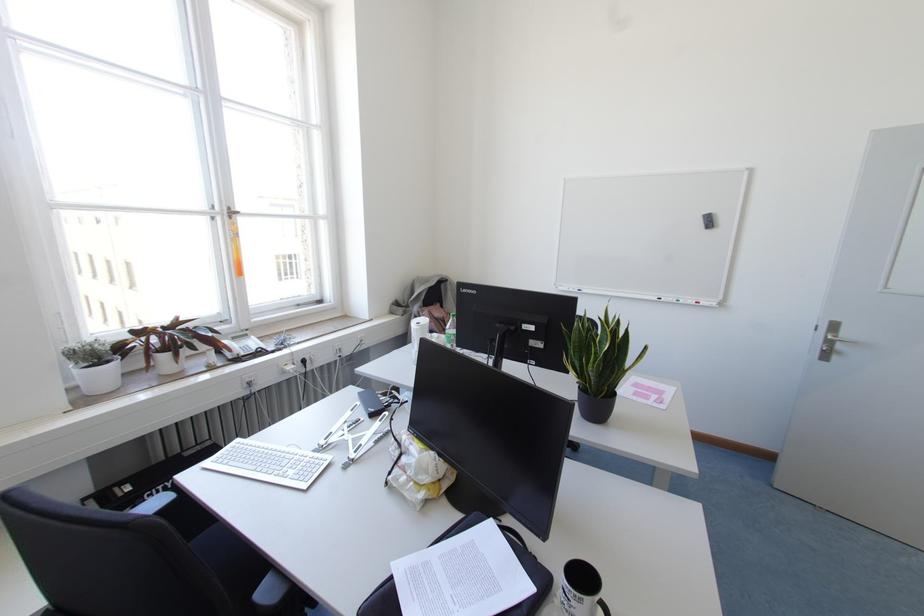
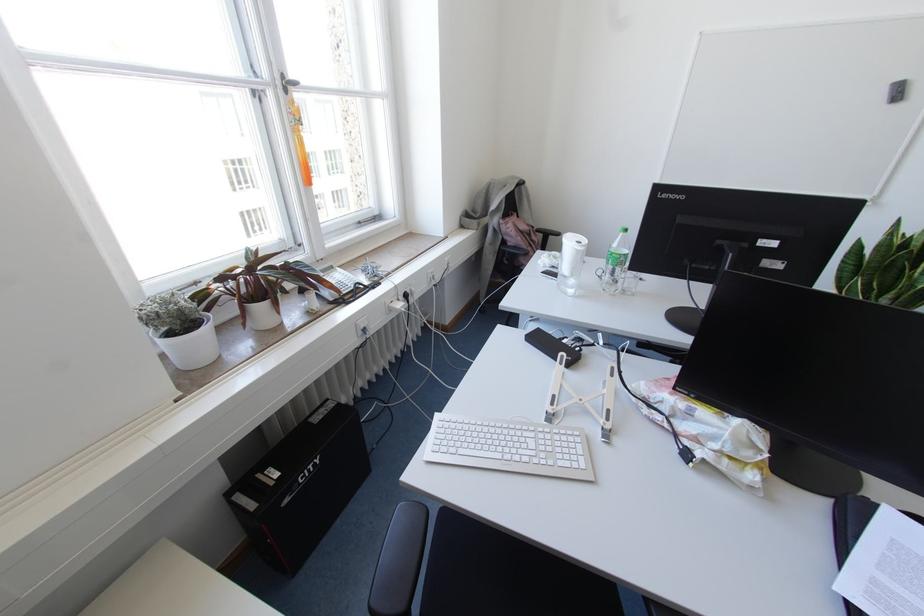
Locate, in the second image, the point that corresponds to [229,217] in the first image.

(285, 90)